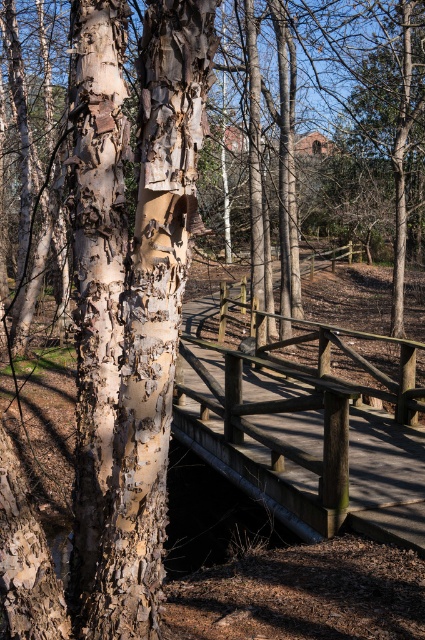
Question: Is the position of white bark tree trunk at center more distant than that of wooden bridge at center?

Choices:
 (A) no
 (B) yes

Answer: (A)

Question: In this image, where is white bark tree trunk at center located relative to wooden bridge at center?

Choices:
 (A) above
 (B) below

Answer: (A)

Question: Which point appears closest to the camera in this image?

Choices:
 (A) (422, 524)
 (B) (107, 246)

Answer: (B)

Question: Does white bark tree trunk at center appear on the right side of wooden bridge at center?

Choices:
 (A) no
 (B) yes

Answer: (A)

Question: Which point appears farthest from the camera in this image?

Choices:
 (A) (374, 490)
 (B) (127, 620)

Answer: (A)

Question: Which point is closer to the camera taking this photo?

Choices:
 (A) (288, 416)
 (B) (158, 240)

Answer: (B)